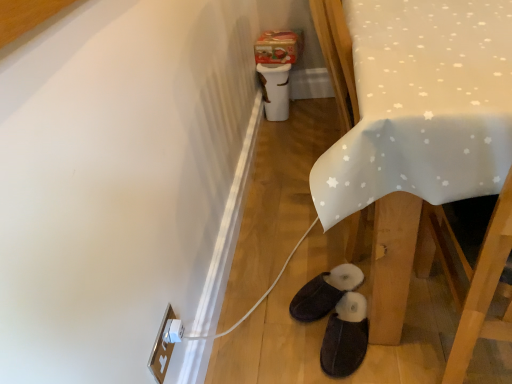
The image size is (512, 384). In order to click on unoccupied space behind black suede slippers at lower center, which is counted as the 1th footwear, starting from the back in this screenshot , I will do `click(311, 258)`.